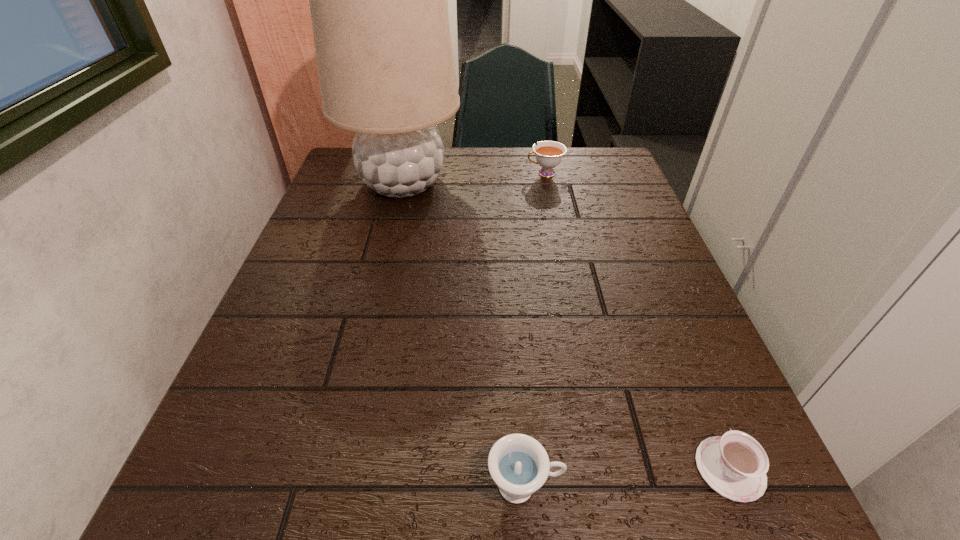
You are a GUI agent. You are given a task and a screenshot of the screen. Output one action in this format:
    pyautogui.click(x=<x>, y=<y>)
    Task: Click on the vacant space located 0.210m on the side of the second object from right to left with the handle
    
    Given the screenshot: What is the action you would take?
    pyautogui.click(x=448, y=173)

This screenshot has width=960, height=540. Find the location of `free space located on the side of the leftmost teacup with the handle`. free space located on the side of the leftmost teacup with the handle is located at coordinates (636, 485).

Where is `vacant area located 0.090m on the handle side of the rightmost teacup`? This screenshot has width=960, height=540. vacant area located 0.090m on the handle side of the rightmost teacup is located at coordinates (695, 384).

Locate an element on the screen. vacant space located 0.090m on the handle side of the rightmost teacup is located at coordinates (695, 384).

Find the location of a particular element. This screenshot has width=960, height=540. vacant space located 0.130m on the handle side of the rightmost teacup is located at coordinates (686, 364).

Identify the location of lampshade that is at the far edge. This screenshot has width=960, height=540. (377, 0).

The width and height of the screenshot is (960, 540). Identify the location of teacup at the far edge. (549, 154).

This screenshot has height=540, width=960. Identify the location of object located at the left edge. (377, 0).

The height and width of the screenshot is (540, 960). In order to click on object present at the right edge in this screenshot , I will do `click(735, 465)`.

Identify the location of object at the far left corner. (377, 0).